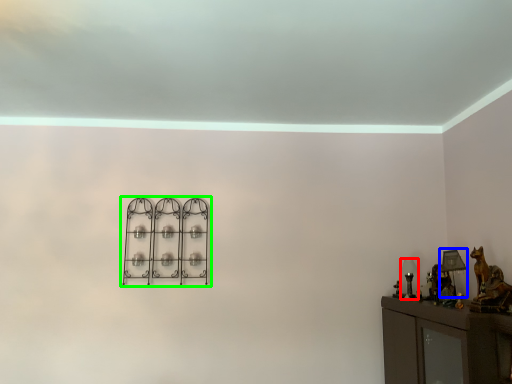
Question: Estimate the real-world distances between objects in this image. Which object is farther from table lamp (highlighted by a red box), table lamp (highlighted by a blue box) or shelf (highlighted by a green box)?

Choices:
 (A) table lamp
 (B) shelf

Answer: (B)